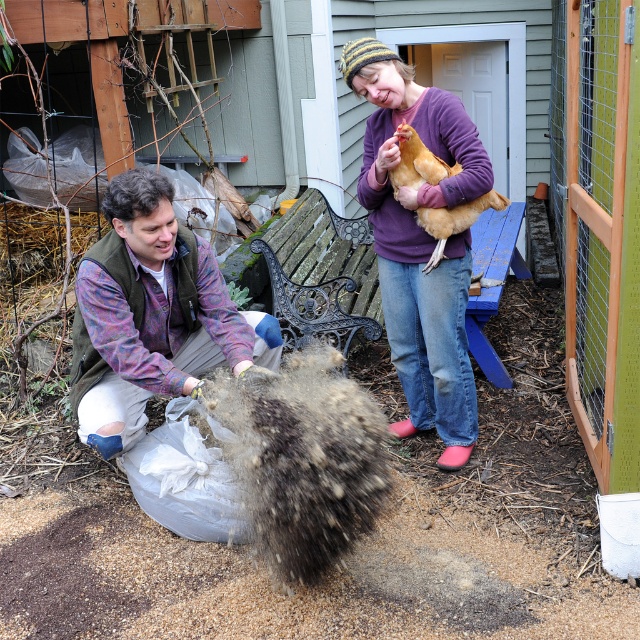
Please provide the 2D coordinates of the ripped denim jeans at lower left in the image. The coordinates should be in the format of a point with two decimal places, such as point 0.5, 0.5. The scene is a backyard with a wooden structure and a wire fence. There are two people near a white plastic bag and a chicken coop with a green door. You must use the exact object label from the Objects section in your answer.

The ripped denim jeans at lower left are located at point [150,316].

You are trying to decide which item to place on a shelf that can only hold items up to the height of the purple soft sweater at center. Can the ripped denim jeans at lower left be placed on the shelf?

The ripped denim jeans at lower left has a lesser height compared to purple soft sweater at center, so yes, the ripped denim jeans at lower left can be placed on the shelf since its height is less than the maximum allowed.